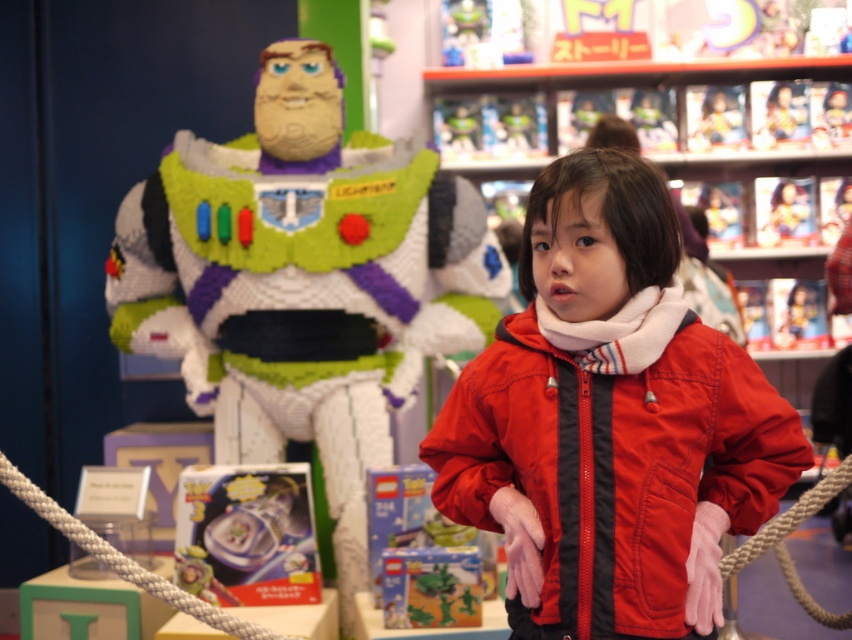
Question: Where is red matte jacket at center located in relation to white lego figure at center in the image?

Choices:
 (A) right
 (B) left

Answer: (A)

Question: Can you confirm if red matte jacket at center is wider than white lego figure at center?

Choices:
 (A) yes
 (B) no

Answer: (B)

Question: Is red matte jacket at center closer to camera compared to white lego figure at center?

Choices:
 (A) no
 (B) yes

Answer: (B)

Question: Which of the following is the farthest from the observer?

Choices:
 (A) (418, 321)
 (B) (661, 337)

Answer: (A)